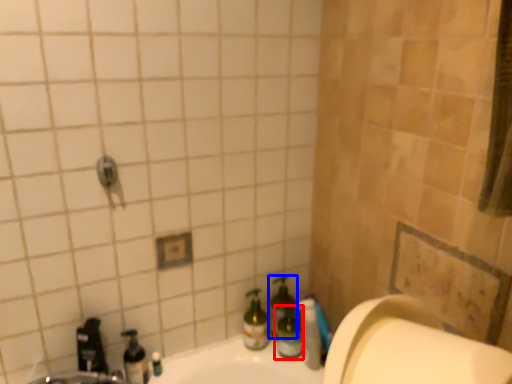
Question: Among these objects, which one is nearest to the camera, bottle (highlighted by a red box) or bottle (highlighted by a blue box)?

Choices:
 (A) bottle
 (B) bottle

Answer: (A)